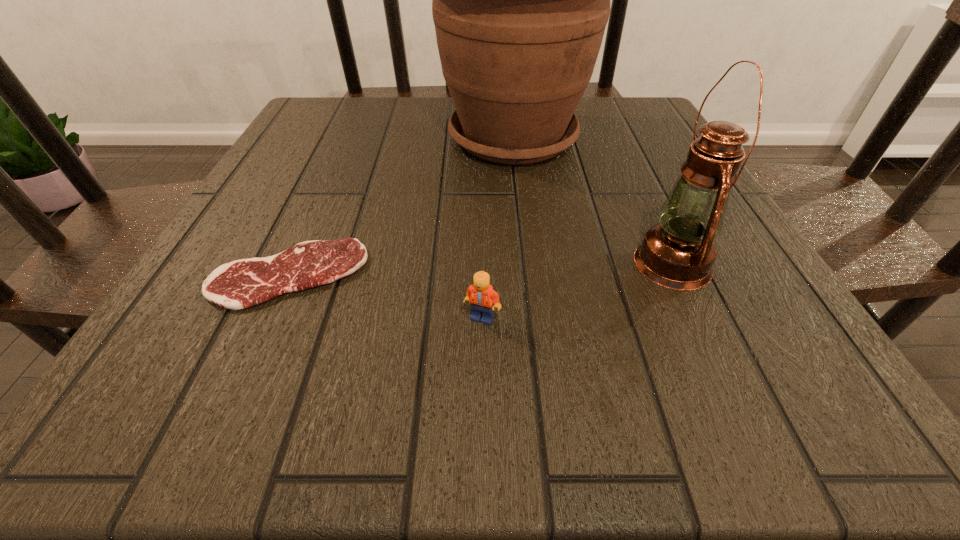
The width and height of the screenshot is (960, 540). I want to click on free space between the flowerpot and the leftmost object, so click(x=401, y=206).

I want to click on free space between the oil lamp and the farthest object, so click(x=593, y=201).

You are a GUI agent. You are given a task and a screenshot of the screen. Output one action in this format:
    pyautogui.click(x=<x>, y=<y>)
    Task: Click on the vacant area that lies between the Lego and the farthest object
    
    Given the screenshot: What is the action you would take?
    pyautogui.click(x=497, y=228)

This screenshot has width=960, height=540. Find the location of `free space between the flowerpot and the oil lamp`. free space between the flowerpot and the oil lamp is located at coordinates (593, 201).

At what (x,y) coordinates should I click in order to perform the action: click on blank region between the oil lamp and the farthest object. Please return your answer as a coordinate pair (x, y). This screenshot has width=960, height=540. Looking at the image, I should click on (593, 201).

This screenshot has width=960, height=540. I want to click on unoccupied area between the oil lamp and the farthest object, so click(x=593, y=201).

Locate an element on the screen. The height and width of the screenshot is (540, 960). free space between the shortest object and the third tallest object is located at coordinates (386, 296).

The image size is (960, 540). What are the coordinates of `free point between the leftmost object and the oil lamp` in the screenshot? It's located at (481, 269).

Find the location of `free space that is in between the shortest object and the oil lamp`. free space that is in between the shortest object and the oil lamp is located at coordinates (481, 269).

Point out which object is positioned as the second nearest to the oil lamp. Please provide its 2D coordinates. Your answer should be formatted as a tuple, i.e. [(x, y)], where the tuple contains the x and y coordinates of a point satisfying the conditions above.

[(481, 296)]